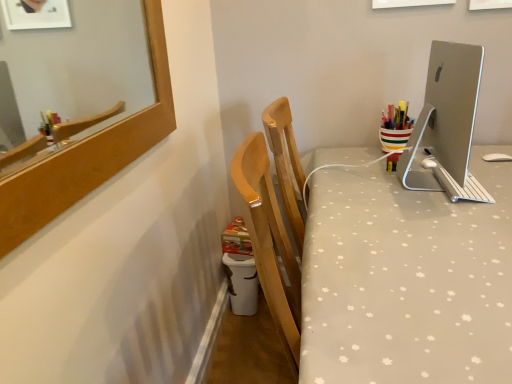
What do you see at coordinates (447, 124) in the screenshot? The image size is (512, 384). I see `silver metallic monitor at upper right` at bounding box center [447, 124].

Image resolution: width=512 pixels, height=384 pixels. Identify the location of silver metallic monitor at upper right. (447, 124).

This screenshot has width=512, height=384. What do you see at coordinates (407, 280) in the screenshot? I see `white dotted fabric at center` at bounding box center [407, 280].

Where is `white dotted fabric at center`? The width and height of the screenshot is (512, 384). white dotted fabric at center is located at coordinates (407, 280).

Where is `silver metallic monitor at upper right`? Image resolution: width=512 pixels, height=384 pixels. silver metallic monitor at upper right is located at coordinates (447, 124).

Can you confirm if white dotted fabric at center is positioned to the right of silver metallic monitor at upper right?

Yes.

From the picture: Is white dotted fabric at center in front of or behind silver metallic monitor at upper right in the image?

white dotted fabric at center is positioned closer to the viewer than silver metallic monitor at upper right.

Which is closer to the camera, (322, 157) or (439, 145)?

Point (322, 157) appears to be farther away from the viewer than point (439, 145).

From the image's perspective, is white dotted fabric at center beneath silver metallic monitor at upper right?

Yes.

From a real-world perspective, relative to silver metallic monitor at upper right, is white dotted fabric at center vertically above or below?

white dotted fabric at center is situated lower than silver metallic monitor at upper right in the real world.

Between white dotted fabric at center and silver metallic monitor at upper right, which one has larger width?

Wider between the two is white dotted fabric at center.

Can you confirm if white dotted fabric at center is shorter than silver metallic monitor at upper right?

In fact, white dotted fabric at center may be taller than silver metallic monitor at upper right.

Is white dotted fabric at center bigger or smaller than silver metallic monitor at upper right?

Considering their sizes, white dotted fabric at center takes up more space than silver metallic monitor at upper right.

Is white dotted fabric at center completely or partially outside of silver metallic monitor at upper right?

Yes, white dotted fabric at center is outside of silver metallic monitor at upper right.

Is white dotted fabric at center beside silver metallic monitor at upper right?

No, white dotted fabric at center is not making contact with silver metallic monitor at upper right.

Is white dotted fabric at center facing towards silver metallic monitor at upper right?

No, white dotted fabric at center is not facing towards silver metallic monitor at upper right.

Can you tell me how much white dotted fabric at center and silver metallic monitor at upper right differ in facing direction?

The facing directions of white dotted fabric at center and silver metallic monitor at upper right are 90 degrees apart.

Where is `desktop computer positioned vertically above the white dotted fabric at center (from a real-world perspective)`? desktop computer positioned vertically above the white dotted fabric at center (from a real-world perspective) is located at coordinates (447, 124).

Based on their positions, is silver metallic monitor at upper right located to the left or right of white dotted fabric at center?

silver metallic monitor at upper right is to the left of white dotted fabric at center.

Is silver metallic monitor at upper right further to camera compared to white dotted fabric at center?

Yes, it is behind white dotted fabric at center.

Considering the points (460, 195) and (451, 227), which point is in front, point (460, 195) or point (451, 227)?

The point (451, 227) is in front.

From the image's perspective, is silver metallic monitor at upper right above or below white dotted fabric at center?

From the image's perspective, silver metallic monitor at upper right appears above white dotted fabric at center.

From a real-world perspective, is silver metallic monitor at upper right physically located above or below white dotted fabric at center?

silver metallic monitor at upper right is situated higher than white dotted fabric at center in the real world.

Which of these two, silver metallic monitor at upper right or white dotted fabric at center, is wider?

Wider between the two is white dotted fabric at center.

Considering the relative sizes of silver metallic monitor at upper right and white dotted fabric at center in the image provided, is silver metallic monitor at upper right taller than white dotted fabric at center?

Incorrect, the height of silver metallic monitor at upper right is not larger of that of white dotted fabric at center.

Who is smaller, silver metallic monitor at upper right or white dotted fabric at center?

Smaller between the two is silver metallic monitor at upper right.

Would you say silver metallic monitor at upper right is outside white dotted fabric at center?

Yes, silver metallic monitor at upper right is outside of white dotted fabric at center.

Is silver metallic monitor at upper right not close to white dotted fabric at center?

That's not correct — silver metallic monitor at upper right is a little close to white dotted fabric at center.

Is silver metallic monitor at upper right positioned with its back to white dotted fabric at center?

No, silver metallic monitor at upper right is not facing away from white dotted fabric at center.

How many degrees apart are the facing directions of silver metallic monitor at upper right and white dotted fabric at center?

silver metallic monitor at upper right and white dotted fabric at center are facing 90 degrees away from each other.

How much distance is there between silver metallic monitor at upper right and white dotted fabric at center?

They are 11.32 inches apart.

Where is `desktop computer on the left of white dotted fabric at center`? desktop computer on the left of white dotted fabric at center is located at coordinates tap(447, 124).

Locate an element on the screen. Image resolution: width=512 pixels, height=384 pixels. desktop computer above the white dotted fabric at center (from the image's perspective) is located at coordinates (447, 124).

Locate an element on the screen. The width and height of the screenshot is (512, 384). desktop computer lying on the left of white dotted fabric at center is located at coordinates (447, 124).